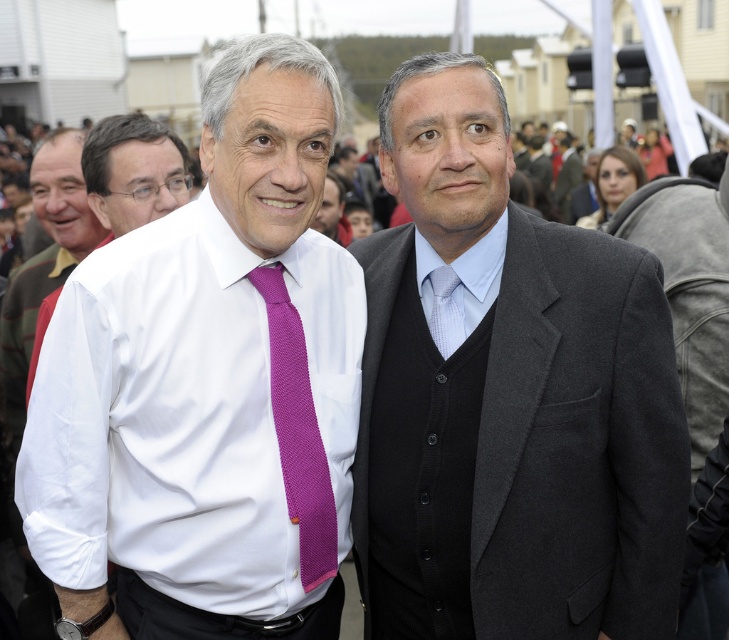
Question: Which point appears farthest from the camera in this image?

Choices:
 (A) (443, 310)
 (B) (521, 339)
 (C) (124, 410)
 (D) (112, 128)

Answer: (D)

Question: Considering the relative positions of dark gray suit at center and white woven shirt at center in the image provided, where is dark gray suit at center located with respect to white woven shirt at center?

Choices:
 (A) left
 (B) right

Answer: (B)

Question: Which of the following is the closest to the observer?

Choices:
 (A) white woven shirt at center
 (B) white knitted dress shirt at center
 (C) light blue textured tie at center

Answer: (B)

Question: Estimate the real-world distances between objects in this image. Which object is farther from the white woven shirt at center?

Choices:
 (A) dark gray suit at center
 (B) white knitted dress shirt at center
 (C) light blue textured tie at center
 (D) purple knitted tie at center

Answer: (A)

Question: Observing the image, what is the correct spatial positioning of purple knitted tie at center in reference to light blue textured tie at center?

Choices:
 (A) above
 (B) below

Answer: (B)

Question: Where is white woven shirt at center located in relation to light blue textured tie at center in the image?

Choices:
 (A) below
 (B) above

Answer: (B)